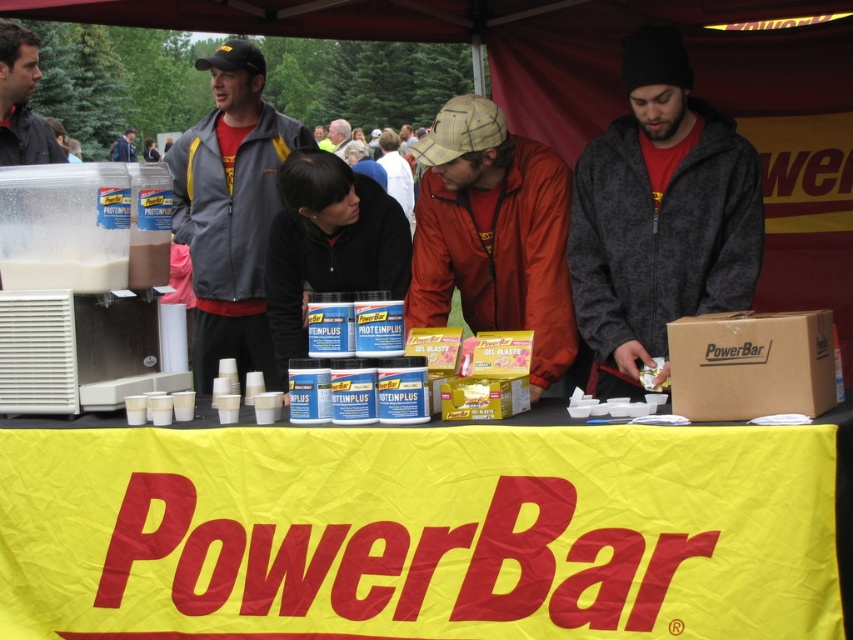
Who is more forward, [33,554] or [428,273]?

Positioned in front is point [33,554].

Between yellow fabric banner at center and red jacket at center, which one appears on the right side from the viewer's perspective?

Positioned to the right is red jacket at center.

Is point (544, 499) behind point (460, 266)?

That is False.

Locate an element on the screen. The image size is (853, 640). yellow fabric banner at center is located at coordinates (431, 531).

Does red jacket at center come behind matte black jacket at center?

That is False.

Does red jacket at center appear on the right side of matte black jacket at center?

Yes, red jacket at center is to the right of matte black jacket at center.

Image resolution: width=853 pixels, height=640 pixels. I want to click on red jacket at center, so click(x=492, y=234).

Locate an element on the screen. red jacket at center is located at coordinates (492, 234).

Can you confirm if yellow fabric banner at center is bigger than matte black jacket at center?

Correct, yellow fabric banner at center is larger in size than matte black jacket at center.

Does yellow fabric banner at center have a greater width compared to matte black jacket at center?

Indeed, yellow fabric banner at center has a greater width compared to matte black jacket at center.

The height and width of the screenshot is (640, 853). Describe the element at coordinates (431, 531) in the screenshot. I see `yellow fabric banner at center` at that location.

The width and height of the screenshot is (853, 640). I want to click on yellow fabric banner at center, so click(x=431, y=531).